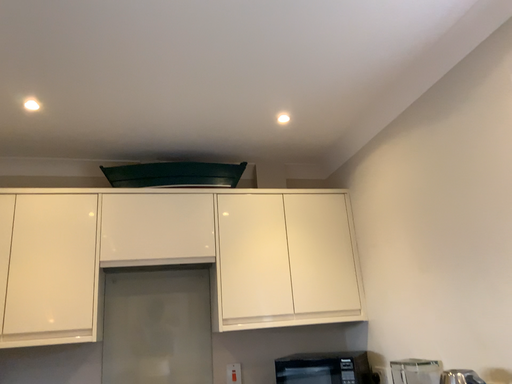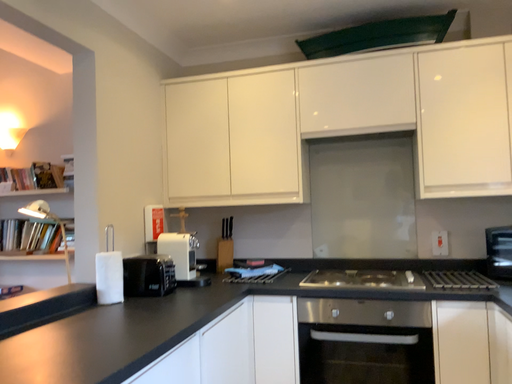
Question: How did the camera likely rotate when shooting the video?

Choices:
 (A) rotated downward
 (B) rotated upward

Answer: (A)